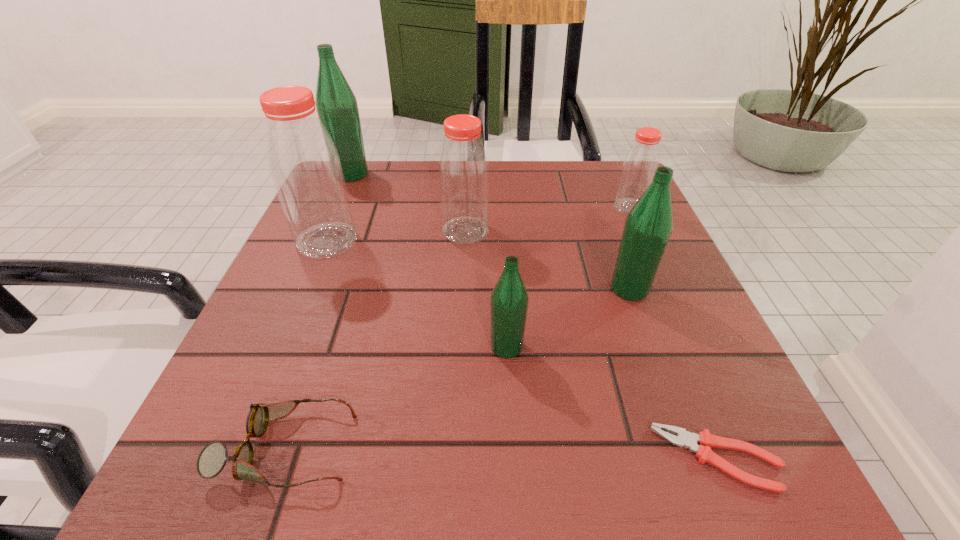
You are a GUI agent. You are given a task and a screenshot of the screen. Output one action in this format:
    pyautogui.click(x=<x>, y=<y>)
    Task: Click on the free space at the left edge
    This screenshot has width=960, height=540.
    Given the screenshot: What is the action you would take?
    pyautogui.click(x=262, y=340)

What are the coordinates of `vacant space at the right edge of the desktop` in the screenshot? It's located at (643, 343).

Image resolution: width=960 pixels, height=540 pixels. In the image, there is a desktop. What are the coordinates of `free space at the far left corner` in the screenshot? It's located at (360, 184).

Locate an element on the screen. This screenshot has width=960, height=540. vacant space at the far right corner is located at coordinates point(572,183).

Where is `free spot between the seventh tallest object and the farthest green bottle`? Image resolution: width=960 pixels, height=540 pixels. free spot between the seventh tallest object and the farthest green bottle is located at coordinates (318, 311).

The image size is (960, 540). What are the coordinates of `free space that is in between the smallest green bottle and the smallest red bottle` in the screenshot? It's located at (568, 277).

Locate an element on the screen. This screenshot has height=540, width=960. empty location between the second green bottle from right to left and the second shortest object is located at coordinates (396, 397).

The width and height of the screenshot is (960, 540). I want to click on blank region between the rightmost red bottle and the farthest green bottle, so click(491, 191).

At what (x,y) coordinates should I click in order to perform the action: click on free space between the leftmost red bottle and the second nearest green bottle. Please return your answer as a coordinate pair (x, y). The image size is (960, 540). Looking at the image, I should click on (478, 265).

At what (x,y) coordinates should I click in order to perform the action: click on empty location between the rightmost red bottle and the farthest green bottle. Please return your answer as a coordinate pair (x, y). Image resolution: width=960 pixels, height=540 pixels. Looking at the image, I should click on (491, 191).